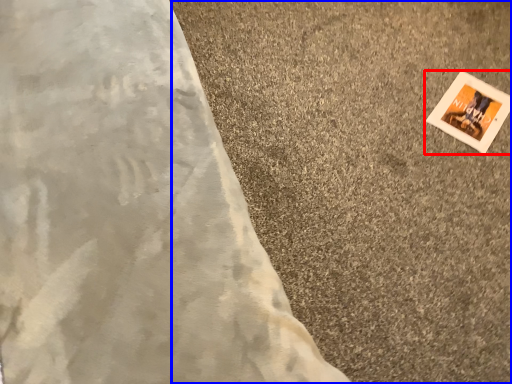
Question: Which object is closer to the camera taking this photo, picture frame (highlighted by a red box) or concrete (highlighted by a blue box)?

Choices:
 (A) picture frame
 (B) concrete

Answer: (B)